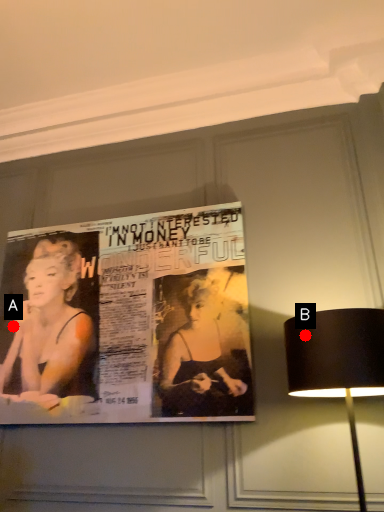
Question: Two points are circled on the image, labeled by A and B beside each circle. Which point is closer to the camera?

Choices:
 (A) A is closer
 (B) B is closer

Answer: (B)